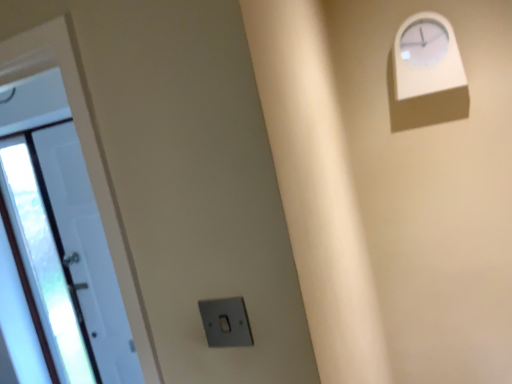
Question: Is white plastic clock at upper right wider or thinner than satin silver switch at lower center?

Choices:
 (A) wide
 (B) thin

Answer: (A)

Question: Would you say white plastic clock at upper right is to the left or to the right of satin silver switch at lower center in the picture?

Choices:
 (A) left
 (B) right

Answer: (B)

Question: Which object is the closest to the satin silver switch at lower center?

Choices:
 (A) white plastic clock at upper right
 (B) white glossy door at left

Answer: (B)

Question: Which of these objects is positioned closest to the white glossy door at left?

Choices:
 (A) satin silver switch at lower center
 (B) white plastic clock at upper right

Answer: (A)